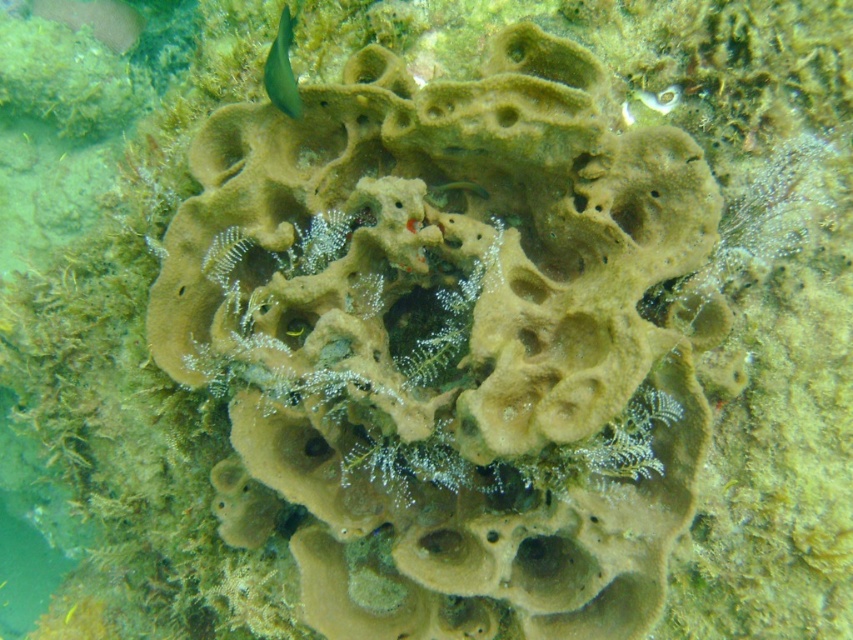
Does green matte fish at upper left have a smaller size compared to green matte fish at center?

No.

Is green matte fish at upper left positioned behind green matte fish at center?

No, green matte fish at upper left is in front of green matte fish at center.

Where is `green matte fish at upper left`? This screenshot has width=853, height=640. green matte fish at upper left is located at coordinates (282, 68).

This screenshot has width=853, height=640. I want to click on green matte fish at upper left, so click(282, 68).